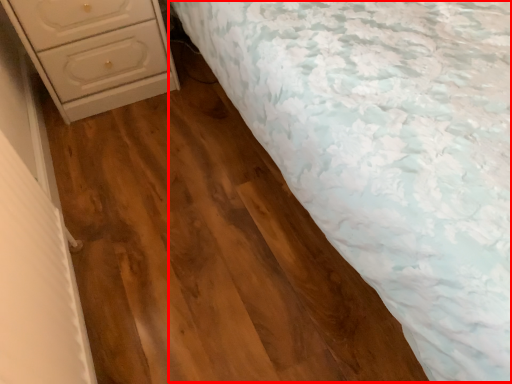
Question: From the image's perspective, where is bed (annotated by the red box) located relative to chest of drawers?

Choices:
 (A) below
 (B) above

Answer: (B)